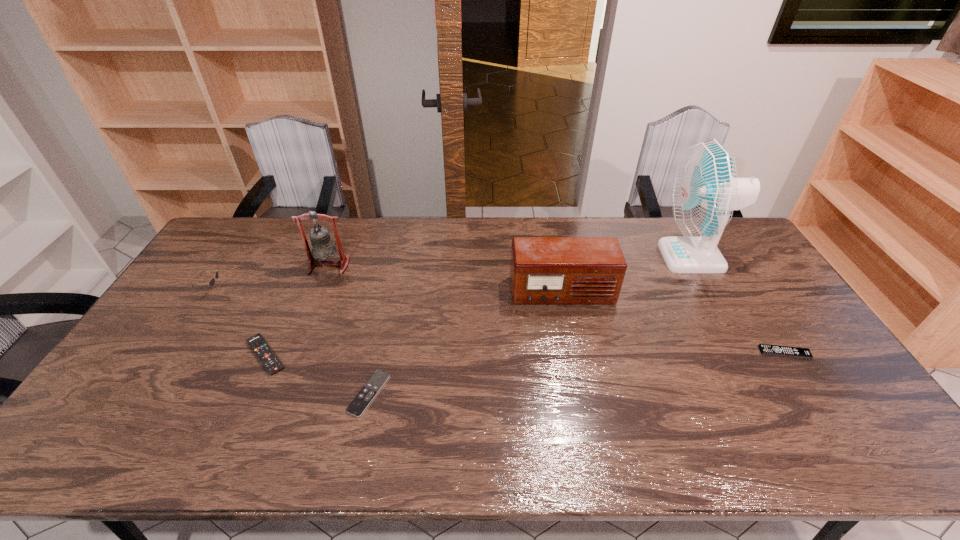
I want to click on vacant area between the leftmost object and the tallest object, so click(452, 274).

This screenshot has height=540, width=960. Find the location of `vacant area between the radio receiver and the second tallest object`. vacant area between the radio receiver and the second tallest object is located at coordinates (445, 279).

The image size is (960, 540). In order to click on free space between the second tallest object and the fan in this screenshot , I will do `click(511, 261)`.

Identify the location of free point between the leftmost object and the third tallest object. (387, 292).

Identify the location of vacant point located between the leftmost object and the rightmost remote control. Image resolution: width=960 pixels, height=540 pixels. 498,321.

The width and height of the screenshot is (960, 540). I want to click on blank region between the second tallest object and the leftmost object, so click(271, 278).

Identify the location of empty space that is in between the fan and the third object from right to left. The width and height of the screenshot is (960, 540). (627, 275).

At what (x,y) coordinates should I click in order to perform the action: click on free spot between the fan and the second remote control from left to right. Please return your answer as a coordinate pair (x, y). The image size is (960, 540). Looking at the image, I should click on (531, 325).

Identify the location of free space between the bell and the radio receiver. (445, 279).

Where is `free space between the rightmost remote control and the leftmost remote control`? This screenshot has width=960, height=540. free space between the rightmost remote control and the leftmost remote control is located at coordinates (525, 354).